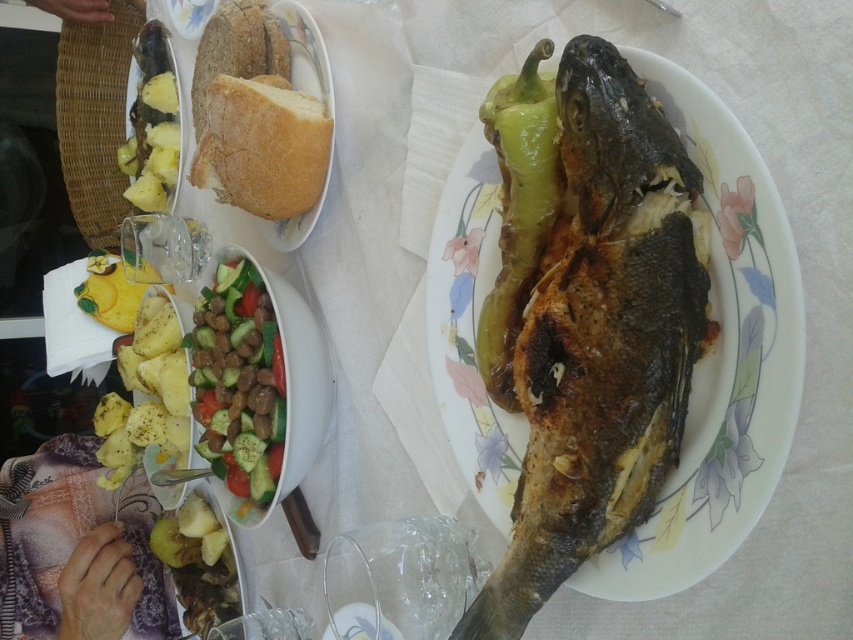
Question: Does yellow roasted potato at lower left have a smaller size compared to yellowish matte pineapple at left?

Choices:
 (A) yes
 (B) no

Answer: (B)

Question: Which is farther from the bread at upper left?

Choices:
 (A) yellow roasted potato at lower left
 (B) green matte pepper at center
 (C) yellowish matte pineapple at left
 (D) sliced cucumber salad at center

Answer: (B)

Question: Is white soft bread at upper center above bread at upper left?

Choices:
 (A) no
 (B) yes

Answer: (A)

Question: Which of the following is the farthest from the observer?

Choices:
 (A) (224, 65)
 (B) (238, 435)

Answer: (A)

Question: Can you confirm if brown crispy fish at center is positioned below bread at upper left?

Choices:
 (A) yes
 (B) no

Answer: (A)

Question: Which point is closer to the camera?

Choices:
 (A) brown crispy fish at center
 (B) yellowish matte pineapple at left
 (C) yellow roasted potato at lower left

Answer: (A)